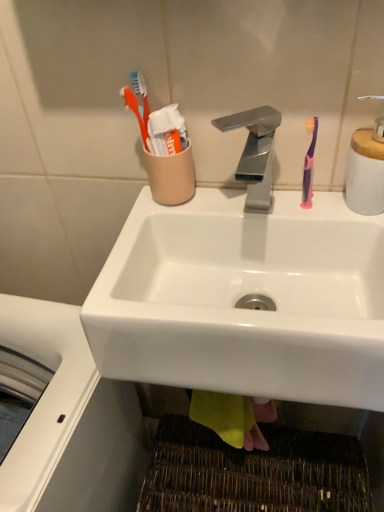
I want to click on blank space to the left of polished metallic faucet at center, so click(146, 230).